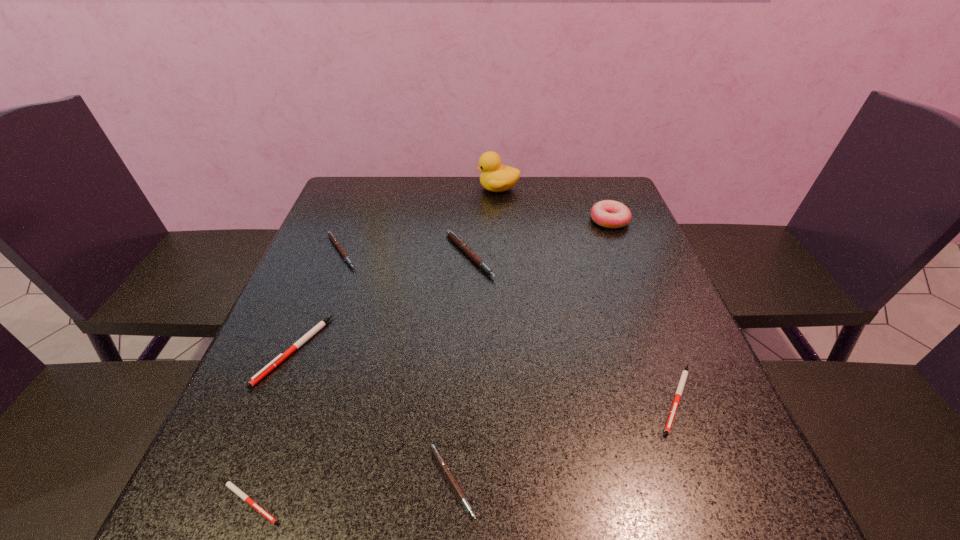
You are a GUI agent. You are given a task and a screenshot of the screen. Output one action in this format:
    pyautogui.click(x=<x>, y=<y>)
    Task: Click on the tallest object
    Image resolution: width=960 pixels, height=540 pixels.
    Given the screenshot: What is the action you would take?
    pyautogui.click(x=495, y=177)

This screenshot has height=540, width=960. In order to click on the farthest object in this screenshot , I will do `click(495, 177)`.

Locate an element on the screen. The width and height of the screenshot is (960, 540). pink doughnut is located at coordinates (607, 213).

The height and width of the screenshot is (540, 960). I want to click on doughnut, so click(x=607, y=213).

Identify the location of the biggest pink pen. Image resolution: width=960 pixels, height=540 pixels. (460, 243).

Find the location of a particular element. This screenshot has height=540, width=960. the sixth shortest object is located at coordinates (460, 243).

The width and height of the screenshot is (960, 540). Find the location of `the second biggest pink pen`. the second biggest pink pen is located at coordinates coord(333,238).

The width and height of the screenshot is (960, 540). I want to click on the biggest white pen, so click(x=268, y=368).

You are a GUI agent. You are given a task and a screenshot of the screen. Output one action in this format:
    pyautogui.click(x=<x>, y=<y>)
    Task: Click on the nearest pink pen
    The image size is (960, 540).
    Given the screenshot: What is the action you would take?
    pyautogui.click(x=439, y=458)

Locate an element on the screen. The height and width of the screenshot is (540, 960). the rightmost white pen is located at coordinates (678, 394).